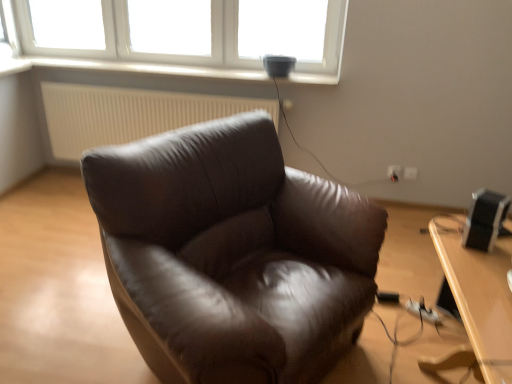
Question: From the image's perspective, would you say light brown wooden table at lower right is positioned over white plastic electric outlet at center-right, which is the 2th electric outlet in right-to-left order?

Choices:
 (A) no
 (B) yes

Answer: (A)

Question: Considering the relative sizes of light brown wooden table at lower right and white plastic electric outlet at center-right, the first electric outlet from the left, in the image provided, is light brown wooden table at lower right taller than white plastic electric outlet at center-right, the first electric outlet from the left,?

Choices:
 (A) no
 (B) yes

Answer: (B)

Question: From the image's perspective, does light brown wooden table at lower right appear lower than white plastic electric outlet at center-right, which is the 2th electric outlet in right-to-left order?

Choices:
 (A) no
 (B) yes

Answer: (B)

Question: Can you confirm if light brown wooden table at lower right is bigger than white plastic electric outlet at center-right, the first electric outlet from the left?

Choices:
 (A) no
 (B) yes

Answer: (B)

Question: From a real-world perspective, is light brown wooden table at lower right on top of white plastic electric outlet at center-right, the first electric outlet from the left?

Choices:
 (A) no
 (B) yes

Answer: (B)

Question: From a real-world perspective, is light brown wooden table at lower right under white plastic electric outlet at center-right, which is the 2th electric outlet in right-to-left order?

Choices:
 (A) yes
 (B) no

Answer: (B)

Question: Are white plastic electric outlet at center-right, which is the 2th electric outlet in right-to-left order, and white plastic window at upper center beside each other?

Choices:
 (A) no
 (B) yes

Answer: (A)

Question: Could you tell me if white plastic electric outlet at center-right, the first electric outlet from the left, is turned towards white plastic window at upper center?

Choices:
 (A) yes
 (B) no

Answer: (B)

Question: Is white plastic electric outlet at center-right, which is the 2th electric outlet in right-to-left order, at the right side of white plastic window at upper center?

Choices:
 (A) yes
 (B) no

Answer: (A)

Question: From the image's perspective, is white plastic electric outlet at center-right, the first electric outlet from the left, on white plastic window at upper center?

Choices:
 (A) no
 (B) yes

Answer: (A)

Question: Can you confirm if white plastic electric outlet at center-right, which is the 2th electric outlet in right-to-left order, is wider than white plastic window at upper center?

Choices:
 (A) yes
 (B) no

Answer: (B)

Question: From a real-world perspective, is white plastic electric outlet at center-right, the first electric outlet from the left, located higher than white plastic window at upper center?

Choices:
 (A) yes
 (B) no

Answer: (B)

Question: Is light brown wooden table at lower right to the left of black plastic speaker at right from the viewer's perspective?

Choices:
 (A) no
 (B) yes

Answer: (A)